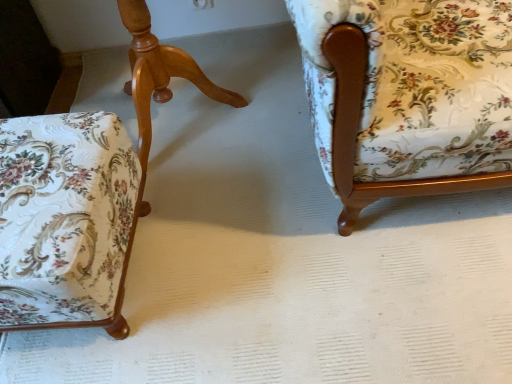
Question: From a real-world perspective, is floral fabric chair at left, arranged as the 2th chair when viewed from the left, located beneath floral fabric chair at right, which is the 1th chair in right-to-left order?

Choices:
 (A) yes
 (B) no

Answer: (A)

Question: Can you confirm if floral fabric chair at left, the 2th chair viewed from the right, is smaller than floral fabric chair at right, which is the 1th chair in right-to-left order?

Choices:
 (A) no
 (B) yes

Answer: (B)

Question: Does floral fabric chair at left, arranged as the 2th chair when viewed from the left, have a greater width compared to floral fabric chair at right, which is the 1th chair in right-to-left order?

Choices:
 (A) yes
 (B) no

Answer: (B)

Question: Is there a large distance between floral fabric chair at left, arranged as the 2th chair when viewed from the left, and floral fabric chair at right, placed as the third chair when sorted from left to right?

Choices:
 (A) no
 (B) yes

Answer: (A)

Question: Could you tell me if floral fabric chair at left, the 2th chair viewed from the right, is facing floral fabric chair at right, placed as the third chair when sorted from left to right?

Choices:
 (A) yes
 (B) no

Answer: (B)

Question: From a real-world perspective, does floral fabric chair at left, arranged as the 2th chair when viewed from the left, stand above floral fabric chair at right, which is the 1th chair in right-to-left order?

Choices:
 (A) no
 (B) yes

Answer: (A)

Question: Is the depth of floral fabric chair at right, which is the 1th chair in right-to-left order, greater than that of floral fabric chair at left, arranged as the 2th chair when viewed from the left?

Choices:
 (A) no
 (B) yes

Answer: (A)

Question: Considering the relative sizes of floral fabric chair at right, placed as the third chair when sorted from left to right, and floral fabric chair at left, arranged as the 2th chair when viewed from the left, in the image provided, is floral fabric chair at right, placed as the third chair when sorted from left to right, smaller than floral fabric chair at left, arranged as the 2th chair when viewed from the left,?

Choices:
 (A) no
 (B) yes

Answer: (A)

Question: Can you confirm if floral fabric chair at right, which is the 1th chair in right-to-left order, is positioned to the left of floral fabric chair at left, arranged as the 2th chair when viewed from the left?

Choices:
 (A) no
 (B) yes

Answer: (A)

Question: Does floral fabric chair at right, placed as the third chair when sorted from left to right, have a lesser height compared to floral fabric chair at left, arranged as the 2th chair when viewed from the left?

Choices:
 (A) yes
 (B) no

Answer: (B)

Question: Is floral fabric chair at right, which is the 1th chair in right-to-left order, positioned in front of floral fabric chair at left, arranged as the 2th chair when viewed from the left?

Choices:
 (A) no
 (B) yes

Answer: (B)

Question: Could you tell me if floral fabric chair at right, placed as the third chair when sorted from left to right, is facing floral fabric chair at left, the 2th chair viewed from the right?

Choices:
 (A) no
 (B) yes

Answer: (A)

Question: Does floral fabric chair at left, the 2th chair viewed from the right, come in front of floral fabric ottoman at lower left, the third chair viewed from the right?

Choices:
 (A) no
 (B) yes

Answer: (A)